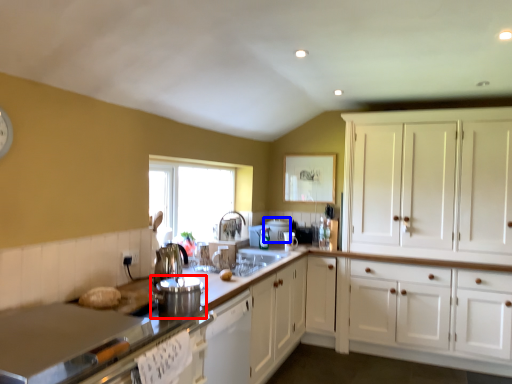
Question: Which object appears closest to the camera in this image, appliance (highlighted by a red box) or appliance (highlighted by a blue box)?

Choices:
 (A) appliance
 (B) appliance

Answer: (A)